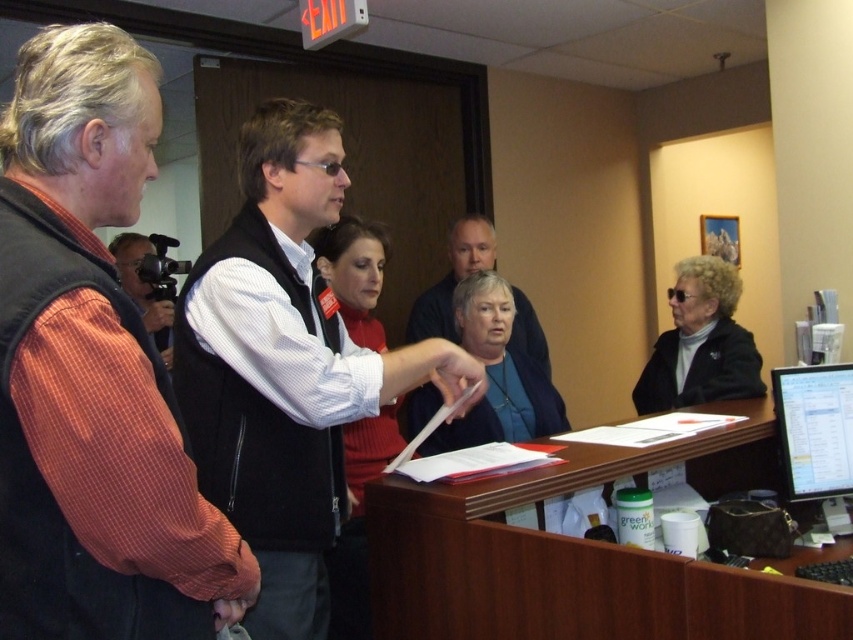
You are a visitor in this room and want to approach the white shirt at center. Which direction should you move relative to the orange striped shirt at left?

The white shirt at center is in front of the orange striped shirt at left, so you should move forward towards the direction of the white shirt at center relative to the orange striped shirt at left.

What is located at the point with coordinates (700,342) in the image?

The black matte jacket at lower right is located at point (700,342).